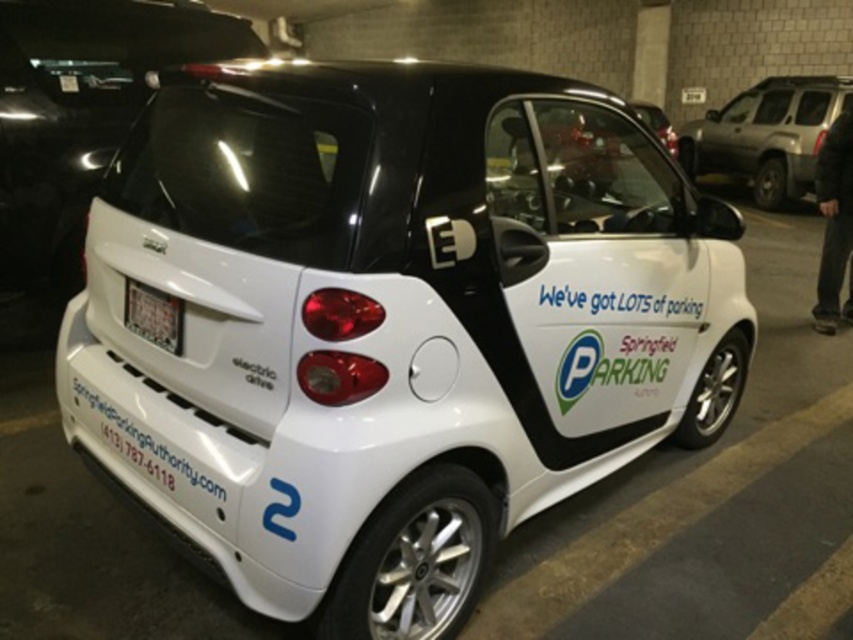
Question: From the image, what is the correct spatial relationship of white glossy bumper at lower left in relation to white plastic license plate at rear?

Choices:
 (A) above
 (B) below

Answer: (A)

Question: Which object is closer to the camera taking this photo?

Choices:
 (A) matte black suv at upper right
 (B) white plastic license plate at rear
 (C) white glossy bumper at lower left

Answer: (B)

Question: Based on their relative distances, which object is farther from the white plastic license plate at rear?

Choices:
 (A) white glossy bumper at lower left
 (B) matte black suv at upper right

Answer: (B)

Question: Is the position of white glossy bumper at lower left more distant than that of white plastic license plate at rear?

Choices:
 (A) no
 (B) yes

Answer: (B)

Question: Is white glossy bumper at lower left to the right of white plastic license plate at rear from the viewer's perspective?

Choices:
 (A) no
 (B) yes

Answer: (A)

Question: Which object is closer to the camera taking this photo?

Choices:
 (A) white glossy bumper at lower left
 (B) white plastic license plate at rear
 (C) matte black suv at upper right

Answer: (B)